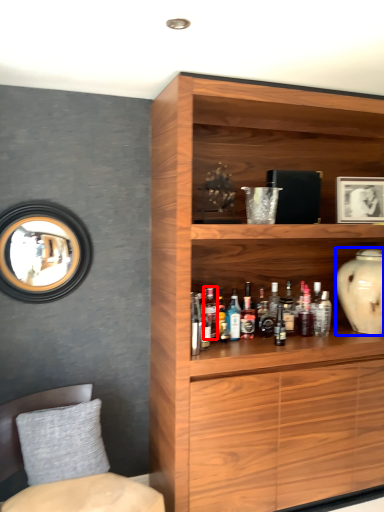
Question: Which object is closer to the camera taking this photo, bottle (highlighted by a red box) or vase (highlighted by a blue box)?

Choices:
 (A) bottle
 (B) vase

Answer: (A)